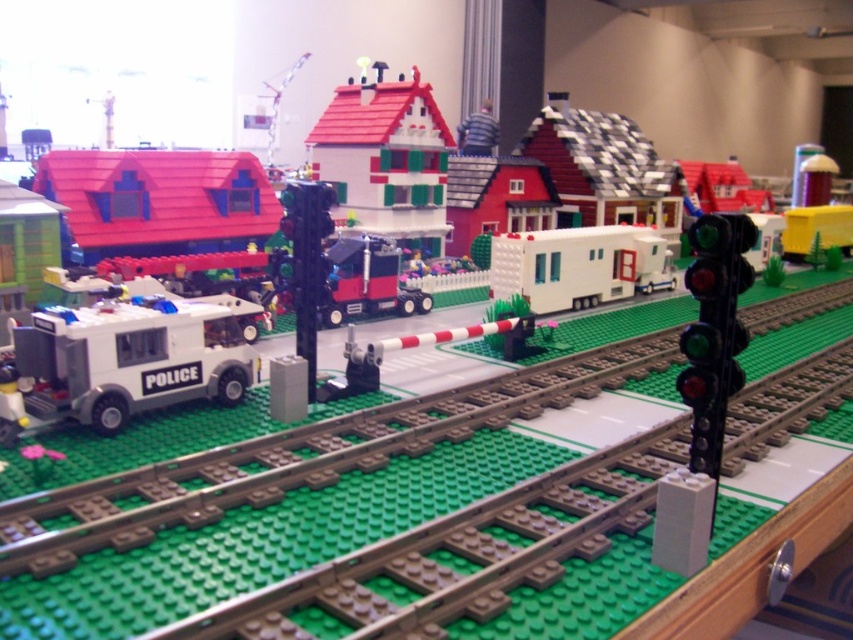
You are a Lego engineer trying to connect the brown textured train track at center and the white matte trailer at center. The minimum required distance for a safe connection is 30 inches. Can you safely connect them?

The distance between the brown textured train track at center and the white matte trailer at center is 27.61 inches, which is less than the required 30 inches. Therefore, you cannot safely connect them.

You are a Lego figure standing on the white road surface near the tracks. You want to go to the matte plastic house at upper left. Which direction should you go to avoid the white matte police car at left?

The white matte police car at left is in front of the matte plastic house at upper left, so to avoid it, you should go around to the side or behind the white matte police car at left to reach the matte plastic house at upper left.

You are a delivery person trying to reach the white matte trailer at center in the Lego scene. There is a smooth white house at center blocking your path. Can you go around it on the left side?

The smooth white house at center is located above the white matte trailer at center, so you can go around it on the left side to reach the trailer.